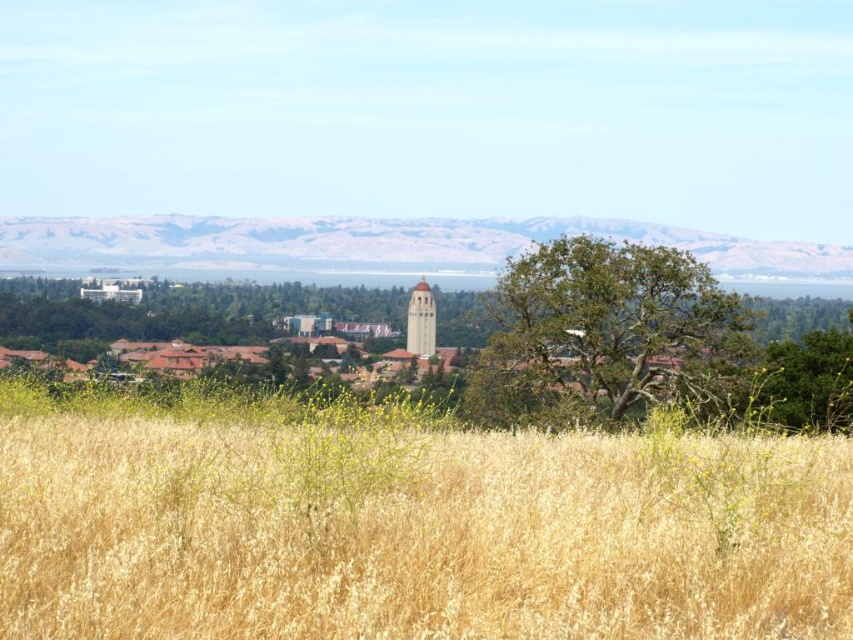
Which of these two, gray/rocky mountain at center or smooth tan bell tower at center, stands taller?

gray/rocky mountain at center

Is gray/rocky mountain at center thinner than smooth tan bell tower at center?

In fact, gray/rocky mountain at center might be wider than smooth tan bell tower at center.

Does point (138, 250) come behind point (412, 294)?

Yes.

You are a GUI agent. You are given a task and a screenshot of the screen. Output one action in this format:
    pyautogui.click(x=<x>, y=<y>)
    Task: Click on the gray/rocky mountain at center
    
    Given the screenshot: What is the action you would take?
    pyautogui.click(x=381, y=244)

Does dry grass at center have a smaller size compared to smooth tan bell tower at center?

Yes.

Between dry grass at center and smooth tan bell tower at center, which one is positioned higher?

smooth tan bell tower at center

Is point (247, 582) positioned after point (428, 308)?

No.

Find the location of `dry grass at center`. dry grass at center is located at coordinates (415, 531).

Is dry grass at center above gray/rocky mountain at center?

No.

Is point (254, 492) positioned behind point (380, 230)?

That is False.

You are a GUI agent. You are given a task and a screenshot of the screen. Output one action in this format:
    pyautogui.click(x=<x>, y=<y>)
    Task: Click on the dry grass at center
    This screenshot has width=853, height=640.
    Given the screenshot: What is the action you would take?
    pyautogui.click(x=415, y=531)